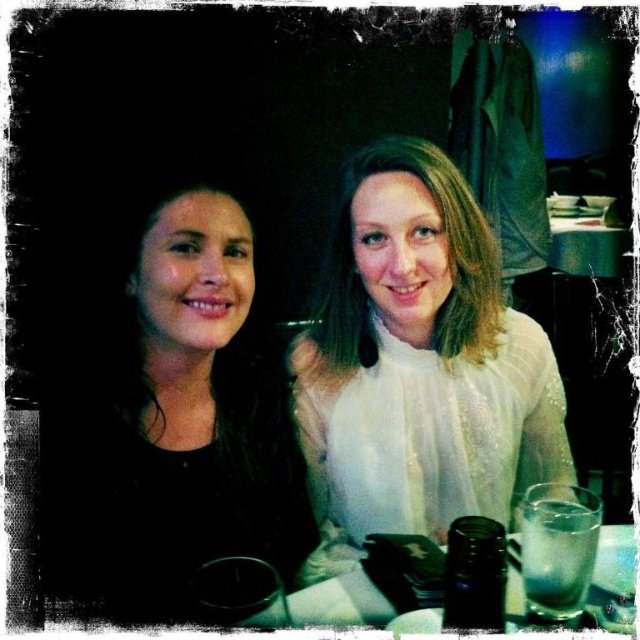
Question: Is white lace blouse at center below clear glass at right?

Choices:
 (A) yes
 (B) no

Answer: (B)

Question: Which object is positioned farthest from the black matte hair at left?

Choices:
 (A) clear glass at right
 (B) white lace blouse at center

Answer: (A)

Question: Does white lace blouse at center have a smaller size compared to clear glass at right?

Choices:
 (A) yes
 (B) no

Answer: (B)

Question: Can you confirm if black matte hair at left is positioned to the right of white lace blouse at center?

Choices:
 (A) no
 (B) yes

Answer: (A)

Question: Which is nearer to the white lace blouse at center?

Choices:
 (A) clear glass at right
 (B) black matte hair at left

Answer: (B)

Question: Among these objects, which one is nearest to the camera?

Choices:
 (A) black matte hair at left
 (B) white lace blouse at center
 (C) clear glass at right

Answer: (C)